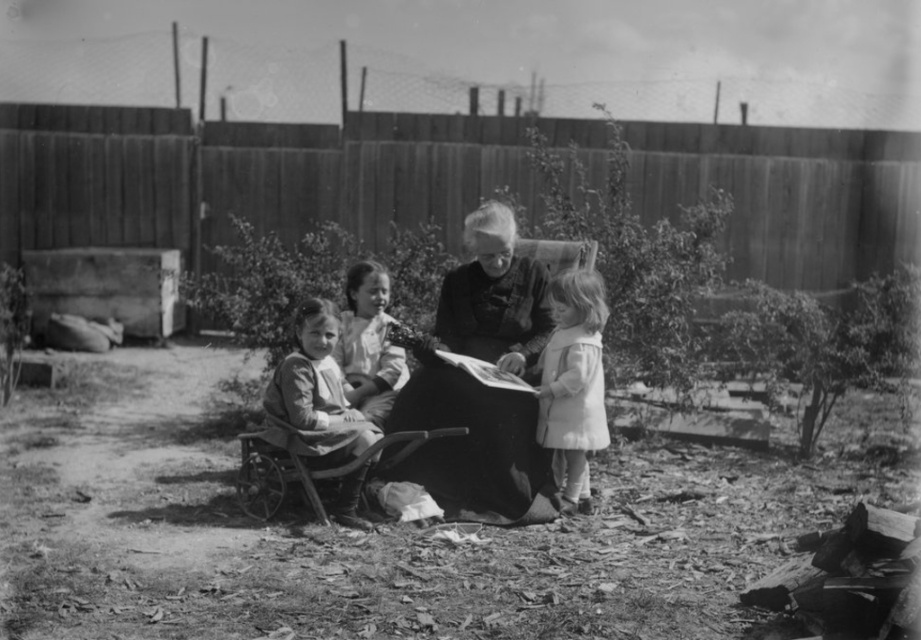
Question: Is smooth black dress at center above fuzzy white coat at lower right?

Choices:
 (A) yes
 (B) no

Answer: (A)

Question: Can you confirm if smooth black dress at center is wider than fuzzy white coat at lower right?

Choices:
 (A) yes
 (B) no

Answer: (A)

Question: Among these objects, which one is farthest from the camera?

Choices:
 (A) matte fabric dress at center
 (B) matte black dress at center
 (C) smooth black dress at center
 (D) white cotton dress at center

Answer: (D)

Question: Observing the image, what is the correct spatial positioning of fuzzy white coat at lower right in reference to matte fabric dress at center?

Choices:
 (A) above
 (B) below

Answer: (A)

Question: Which object is the farthest from the fuzzy white coat at lower right?

Choices:
 (A) smooth black dress at center
 (B) matte black dress at center

Answer: (A)

Question: Which object is closer to the camera taking this photo?

Choices:
 (A) fuzzy white coat at lower right
 (B) smooth black dress at center
 (C) white cotton dress at center
 (D) matte black dress at center

Answer: (D)